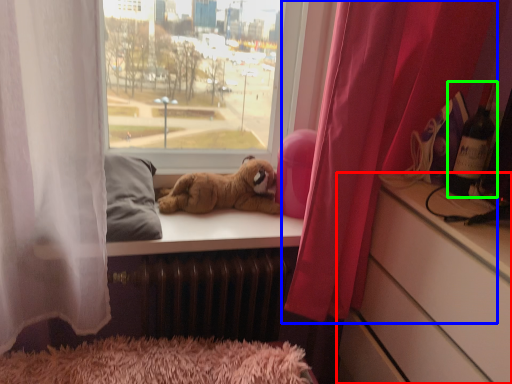
Question: Considering the real-world distances, which object is closest to cabinetry (highlighted by a red box)? curtain (highlighted by a blue box) or wine bottle (highlighted by a green box).

Choices:
 (A) curtain
 (B) wine bottle

Answer: (A)